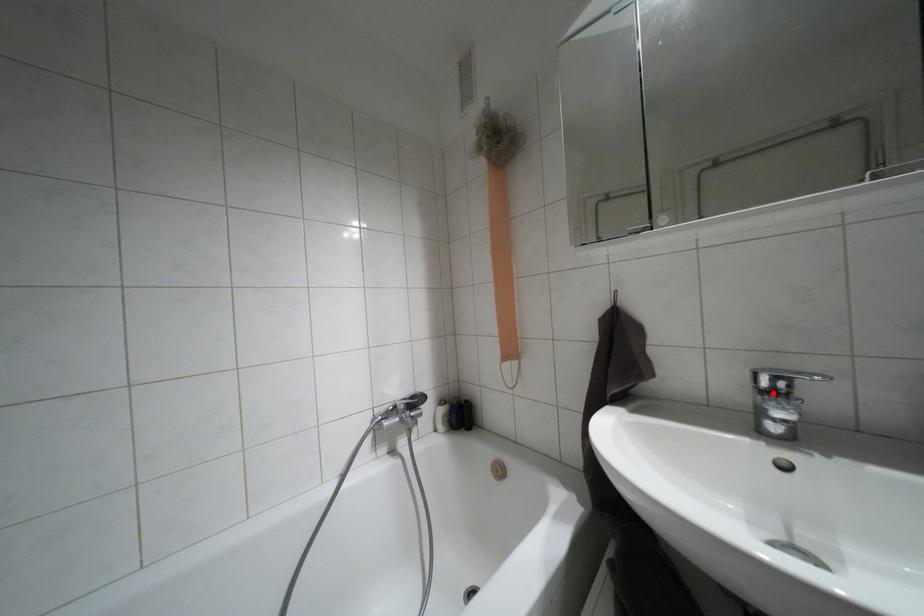
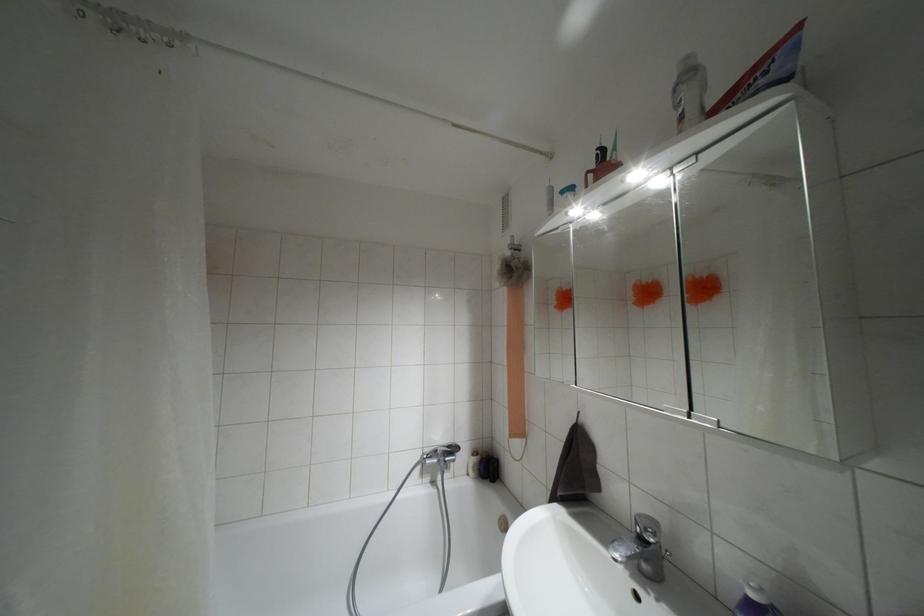
Where in the second image is the point corresponding to the highlighted location from the first image?

(641, 538)